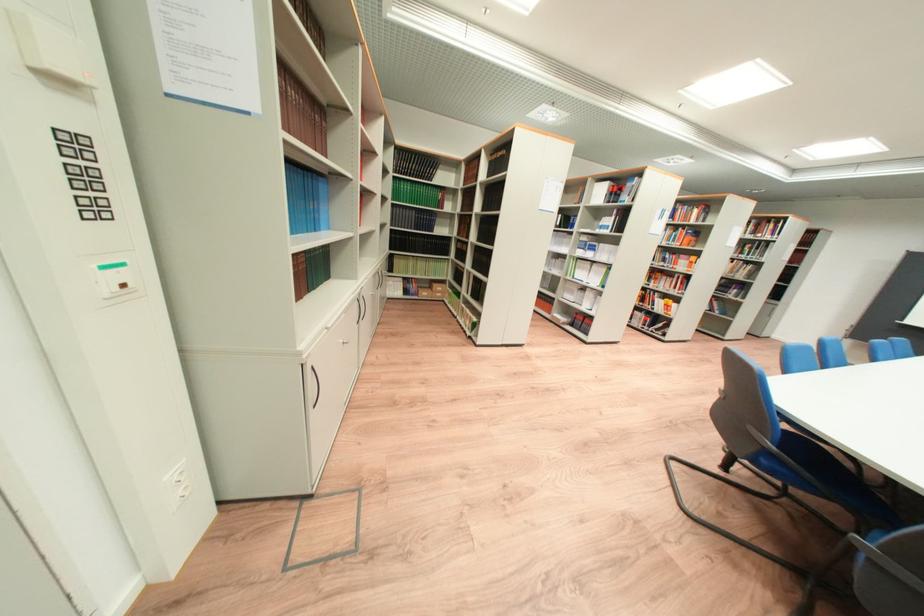
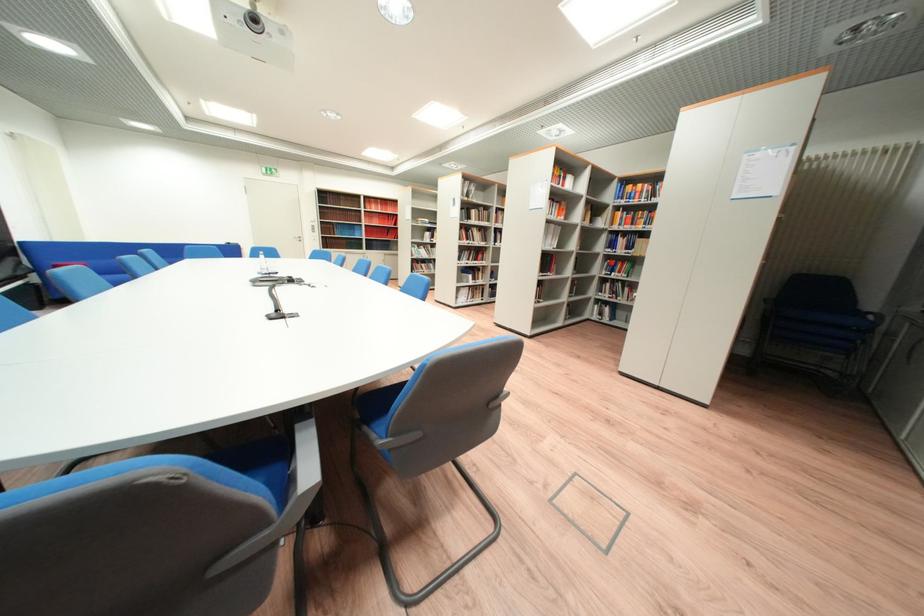
Question: I am providing you with two images of the same scene from different viewpoints. Which of the following objects are not visible in image2?

Choices:
 (A) blue book
 (B) grey chair armrest
 (C) dark handbag
 (D) blue chair sitting surface

Answer: (D)